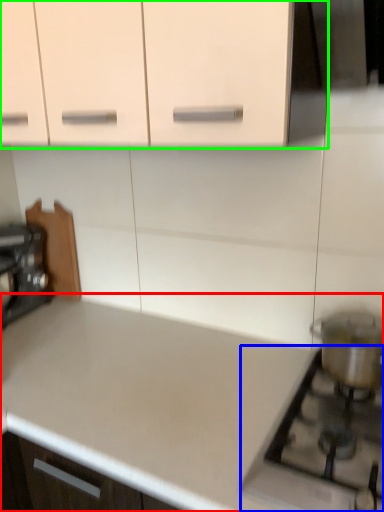
Question: Which object is the farthest from countertop (highlighted by a red box)? Choose among these: gas stove (highlighted by a blue box) or cabinetry (highlighted by a green box).

Choices:
 (A) gas stove
 (B) cabinetry

Answer: (B)